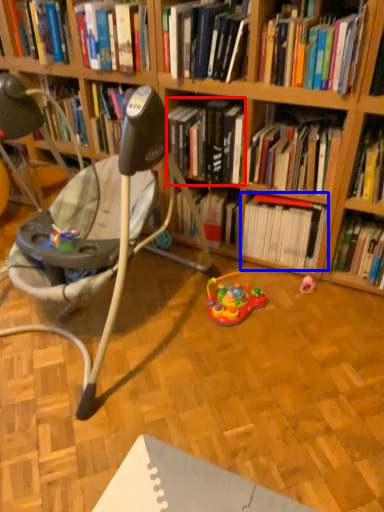
Question: Which object appears closest to the camera in this image, book (highlighted by a red box) or book (highlighted by a blue box)?

Choices:
 (A) book
 (B) book

Answer: (A)